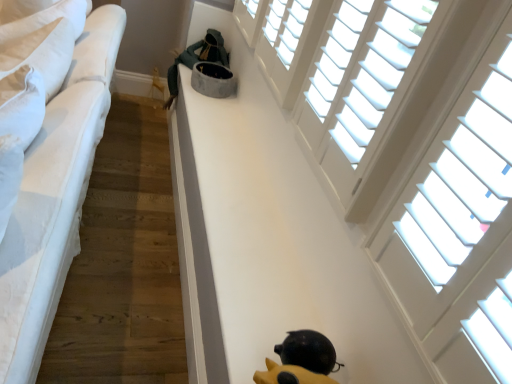
Question: Based on their positions, is white wood blinds at upper right, which is the second window in front-to-back order, located to the left or right of white wood blinds at upper right, acting as the 1th window starting from the front?

Choices:
 (A) left
 (B) right

Answer: (A)

Question: Is white wood blinds at upper right, which is the second window in front-to-back order, bigger or smaller than white wood blinds at upper right, marked as the second window in a back-to-front arrangement?

Choices:
 (A) big
 (B) small

Answer: (A)

Question: Considering the real-world distances, which object is closest to the dark gray plush cat bed at upper center?

Choices:
 (A) white wood blinds at upper right, acting as the 1th window starting from the front
 (B) white wood blinds at upper right, which is counted as the first window, starting from the back
 (C) yellow rubber duck at lower center
 (D) white fabric bed at left

Answer: (D)

Question: Based on their relative distances, which object is farther from the dark gray plush cat bed at upper center?

Choices:
 (A) white wood blinds at upper right, acting as the 1th window starting from the front
 (B) white wood blinds at upper right, which is the second window in front-to-back order
 (C) yellow rubber duck at lower center
 (D) white fabric bed at left

Answer: (C)